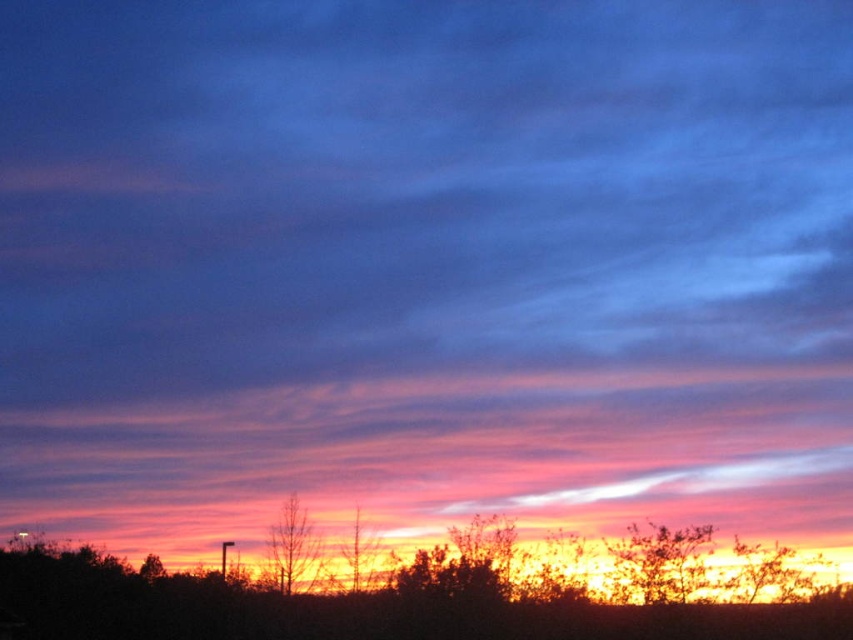
Question: Which point is closer to the camera?

Choices:
 (A) (273, 573)
 (B) (352, 556)
 (C) (477, 637)

Answer: (C)

Question: Based on their relative distances, which object is farther from the silhouette tree at lower center?

Choices:
 (A) silhouette wood at center
 (B) bare branches at center

Answer: (B)

Question: Can you confirm if silhouette tree at lower center is thinner than bare branches at center?

Choices:
 (A) no
 (B) yes

Answer: (A)

Question: Which point is closer to the camera?

Choices:
 (A) (363, 529)
 (B) (680, 604)
 (C) (297, 586)

Answer: (B)

Question: Is silhouette tree at lower center smaller than silhouette wood at center?

Choices:
 (A) no
 (B) yes

Answer: (A)

Question: Is silhouette tree at lower center below silhouette wood at center?

Choices:
 (A) yes
 (B) no

Answer: (A)